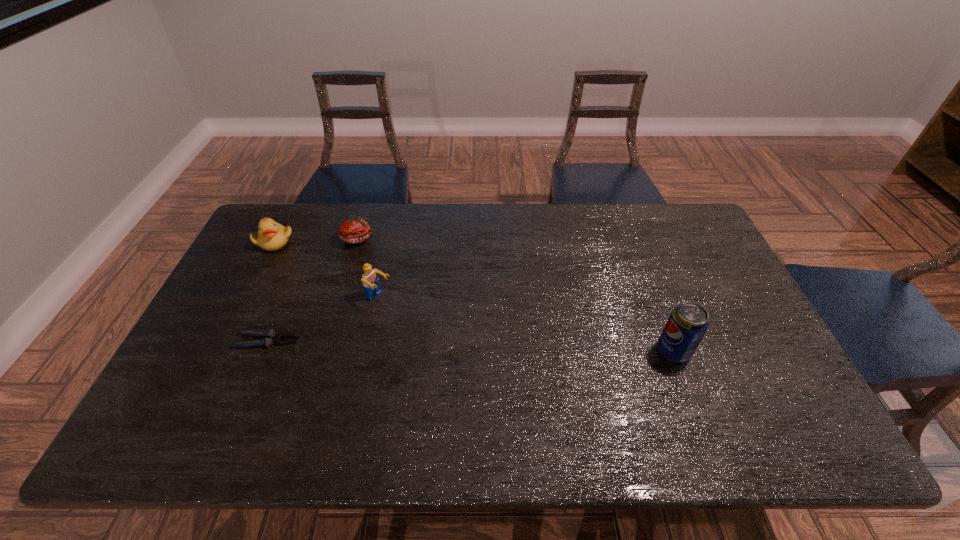
This screenshot has width=960, height=540. Identify the location of free space between the fourth object from left to right and the rightmost object. (526, 325).

This screenshot has width=960, height=540. Find the location of `blank region between the third object from left to right and the pliers`. blank region between the third object from left to right and the pliers is located at coordinates (312, 290).

Image resolution: width=960 pixels, height=540 pixels. In order to click on unoccupied position between the shortest object and the duckling in this screenshot , I will do `click(271, 291)`.

Image resolution: width=960 pixels, height=540 pixels. In order to click on unoccupied area between the duckling and the third object from left to right in this screenshot , I will do `click(316, 240)`.

This screenshot has height=540, width=960. Identify the location of free space between the rightmost object and the duckling. (474, 296).

I want to click on vacant region between the shortest object and the tallest object, so click(x=470, y=346).

At what (x,y) coordinates should I click in order to perform the action: click on vacant area that lies between the tomato and the duckling. Please return your answer as a coordinate pair (x, y). Looking at the image, I should click on click(316, 240).

Locate an element on the screen. vacant region between the third object from right to left and the shortest object is located at coordinates (312, 290).

Find the location of a particular element. vacant space that's between the rightmost object and the third object from right to left is located at coordinates (516, 295).

Identify the location of the closest object to the second tallest object. This screenshot has height=540, width=960. (352, 229).